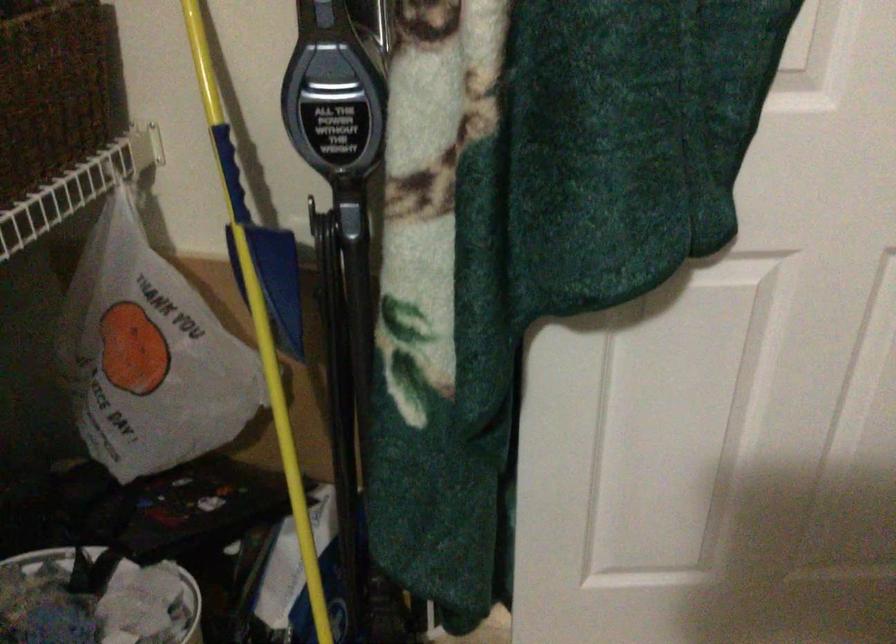
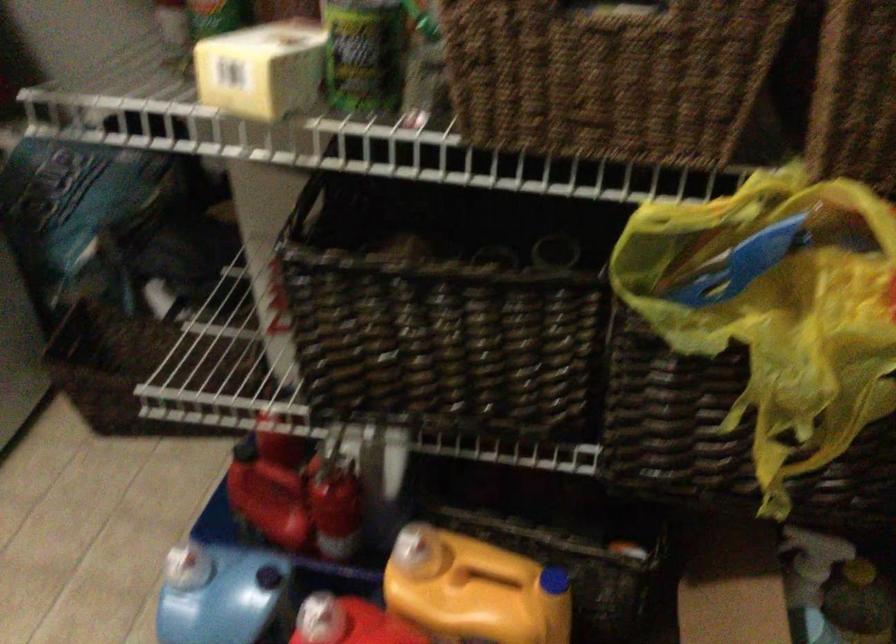
How did the camera likely rotate?

The camera rotated toward left-down.